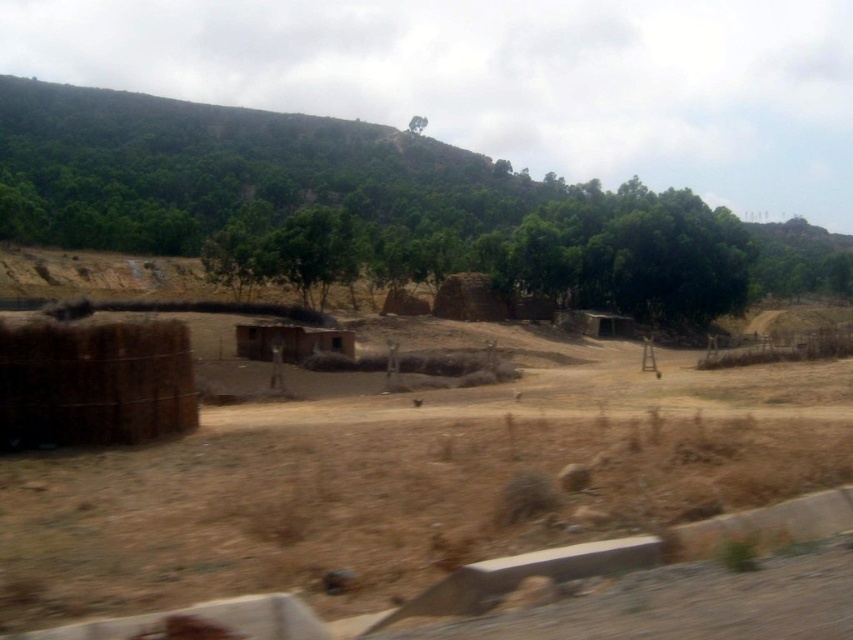
In the scene shown: Can you confirm if green leafy tree at upper center is wider than brown matte train window at center?

Indeed, green leafy tree at upper center has a greater width compared to brown matte train window at center.

Who is shorter, green leafy tree at upper center or brown matte train window at center?

brown matte train window at center

Between point (416, 116) and point (335, 346), which one is positioned in front?

Positioned in front is point (335, 346).

Find the location of a particular element. green leafy tree at upper center is located at coordinates (x=416, y=124).

Does brown mud hut at center have a lesser width compared to brown matte train window at center?

No, brown mud hut at center is not thinner than brown matte train window at center.

Can you confirm if brown mud hut at center is positioned below brown matte train window at center?

Incorrect, brown mud hut at center is not positioned below brown matte train window at center.

The width and height of the screenshot is (853, 640). What are the coordinates of `brown mud hut at center` in the screenshot? It's located at (287, 340).

Identify the location of brown mud hut at center. This screenshot has height=640, width=853. (287, 340).

Can you confirm if brown dry dirt field at center is positioned below green leafy tree at upper center?

Yes.

Between brown dry dirt field at center and green leafy tree at upper center, which one has more height?

With more height is green leafy tree at upper center.

Who is more distant from viewer, (403,410) or (418,125)?

The point (418,125) is more distant.

Find the location of `brown dry dirt field at center`. brown dry dirt field at center is located at coordinates pos(405,484).